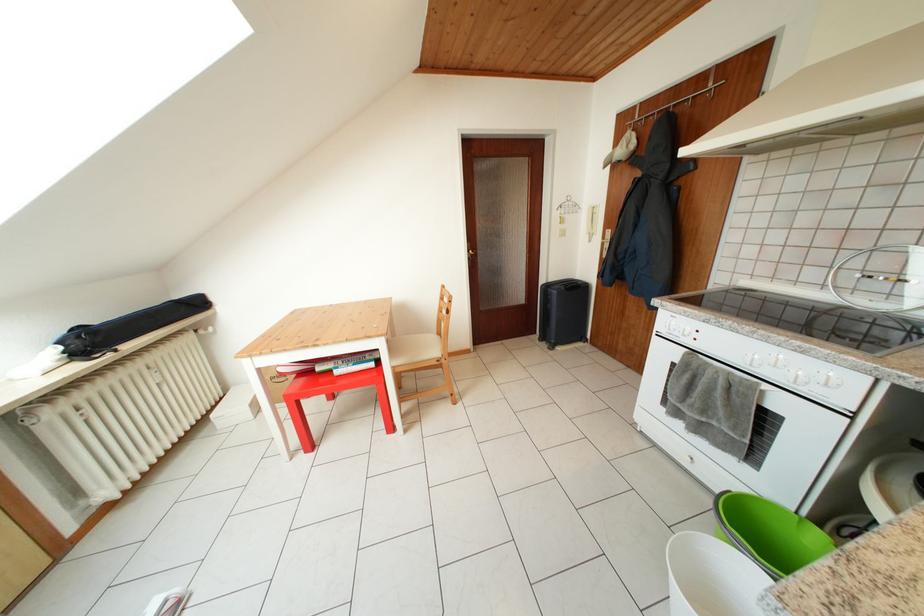
This screenshot has height=616, width=924. I want to click on gold door handle, so click(470, 252).